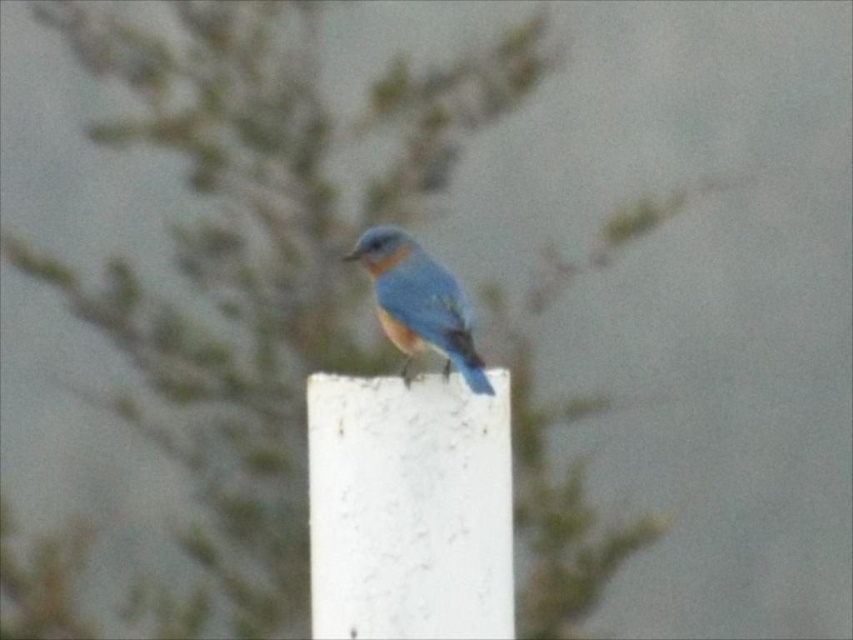
Which is in front, point (341, 552) or point (467, 342)?

Positioned in front is point (341, 552).

Can you confirm if white textured pillar at center is positioned to the left of blue glossy bird at center?

Correct, you'll find white textured pillar at center to the left of blue glossy bird at center.

Which is behind, point (328, 486) or point (396, 227)?

Point (396, 227)

You are a GUI agent. You are given a task and a screenshot of the screen. Output one action in this format:
    pyautogui.click(x=<x>, y=<y>)
    Task: Click on the white textured pillar at center
    
    Given the screenshot: What is the action you would take?
    pyautogui.click(x=409, y=508)